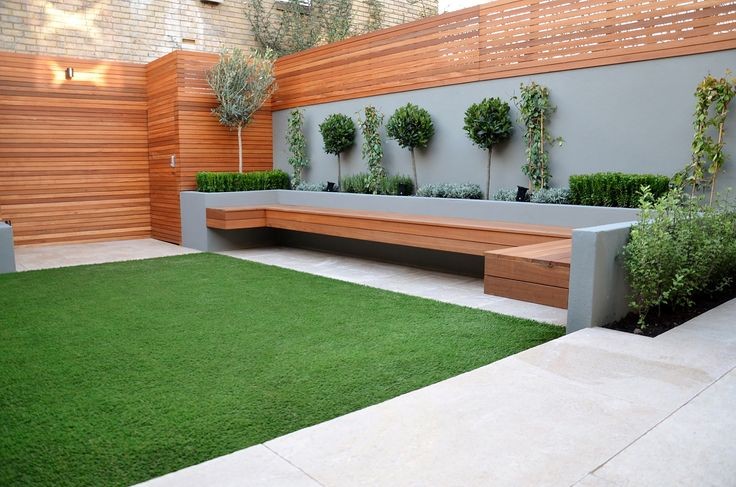
Find the location of `brick wall`. brick wall is located at coordinates (90, 33), (227, 22), (389, 14).